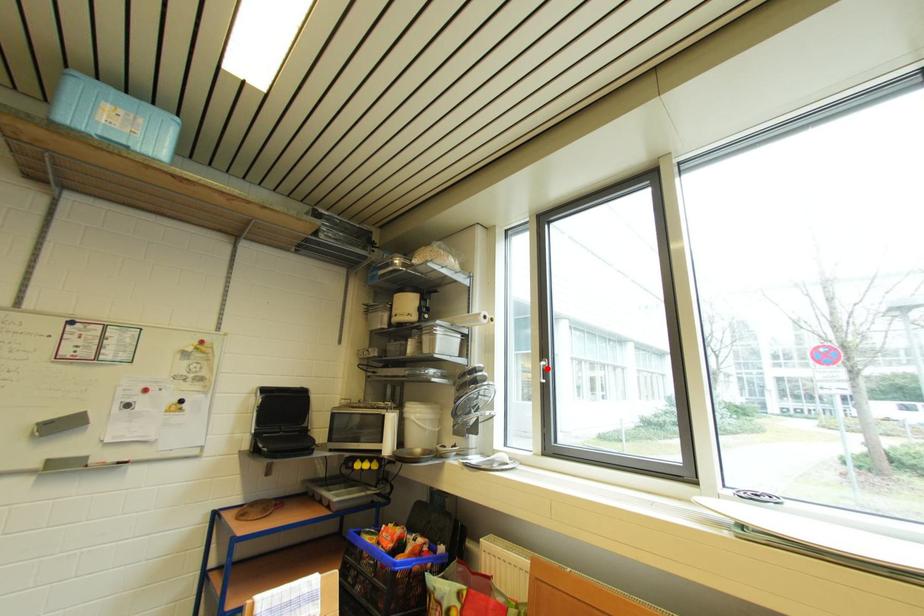
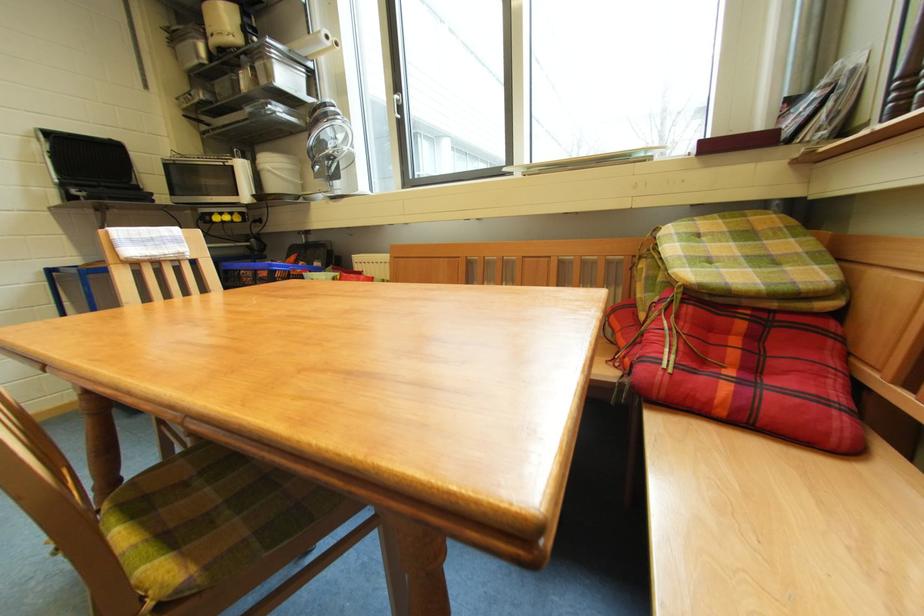
Where in the second image is the point corresponding to the highlighted location from the first image?

(402, 102)